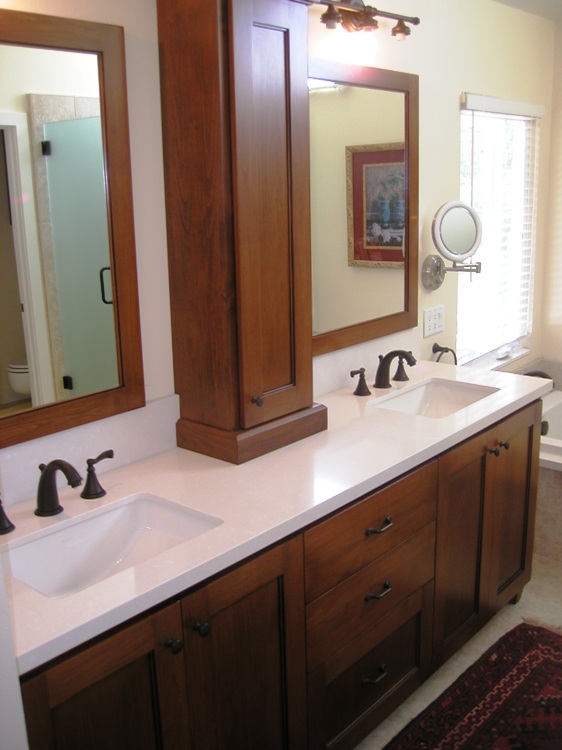
Find the location of a particular element. Image resolution: width=562 pixels, height=750 pixels. round towel holder is located at coordinates (444, 350).